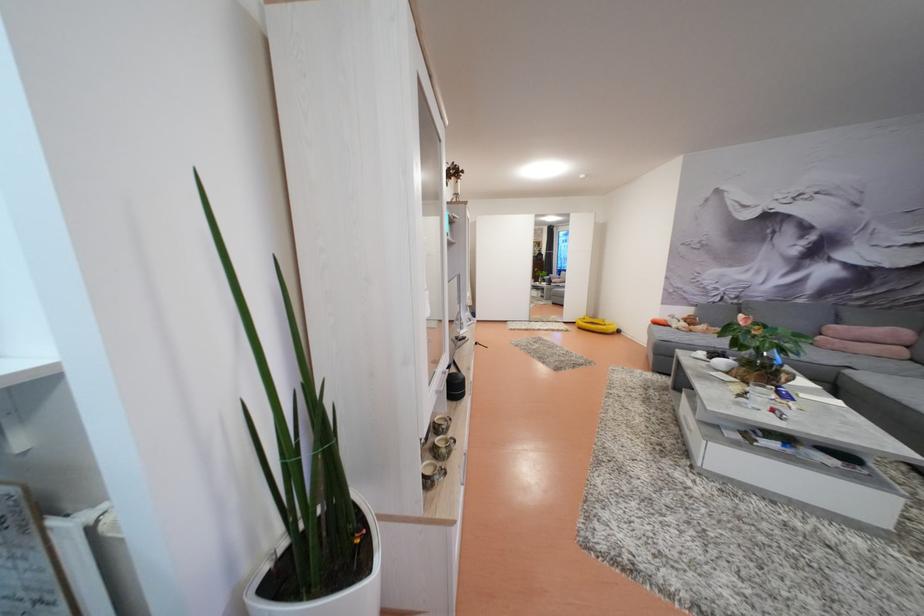
I want to click on black cylindrical speaker, so click(x=455, y=386).